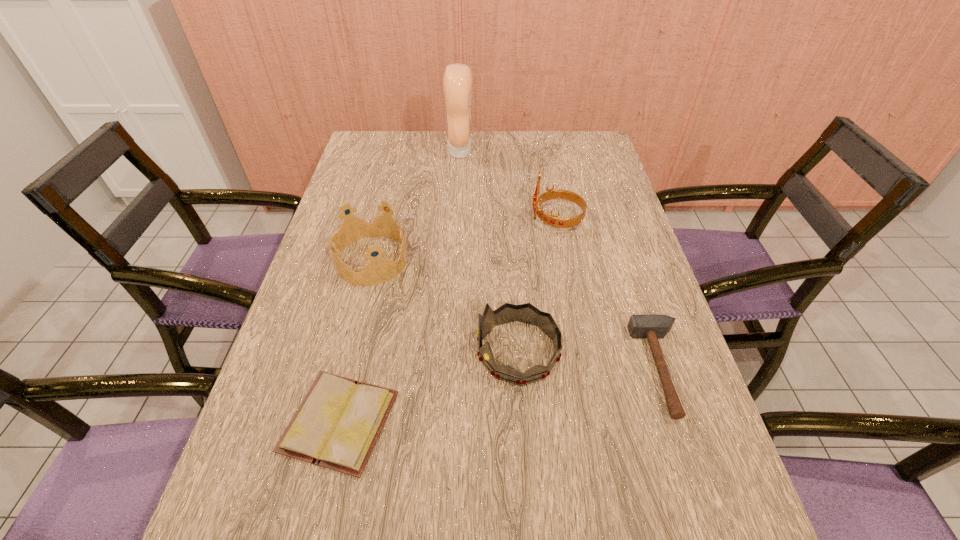
The height and width of the screenshot is (540, 960). In the image, there is a desktop. Identify the location of blank space at the far right corner. tap(556, 144).

The image size is (960, 540). I want to click on free area in between the tallest object and the fifth shortest object, so click(509, 186).

You are a GUI agent. You are given a task and a screenshot of the screen. Output one action in this format:
    pyautogui.click(x=<x>, y=<y>)
    Task: Click on the vacant point located between the fifth tallest object and the nearest tiara
    The image size is (960, 540).
    Given the screenshot: What is the action you would take?
    pyautogui.click(x=589, y=360)

Where is `blank region between the fifth tallest object and the diary`? This screenshot has height=540, width=960. blank region between the fifth tallest object and the diary is located at coordinates (501, 395).

At what (x,y) coordinates should I click in order to perform the action: click on vacant space that is in between the second shortest object and the second tallest object. Please return your answer as a coordinate pair (x, y). Looking at the image, I should click on (610, 294).

Identify the location of free space between the rightmost object and the diary. The width and height of the screenshot is (960, 540). (501, 395).

Identify the location of empty space that is in between the nearest tiara and the tallest object. The image size is (960, 540). (489, 252).

Find the location of a particular element. The width and height of the screenshot is (960, 540). blank region between the leftmost tiara and the nearest tiara is located at coordinates (444, 306).

Where is `vacant region between the fourth nearest object and the nearest tiara`? The width and height of the screenshot is (960, 540). vacant region between the fourth nearest object and the nearest tiara is located at coordinates (444, 306).

You are a GUI agent. You are given a task and a screenshot of the screen. Output one action in this format:
    pyautogui.click(x=<x>, y=<y>)
    Task: Click on the free spot between the nearest tiara and the farthest object
    The height and width of the screenshot is (540, 960).
    Given the screenshot: What is the action you would take?
    pyautogui.click(x=489, y=252)